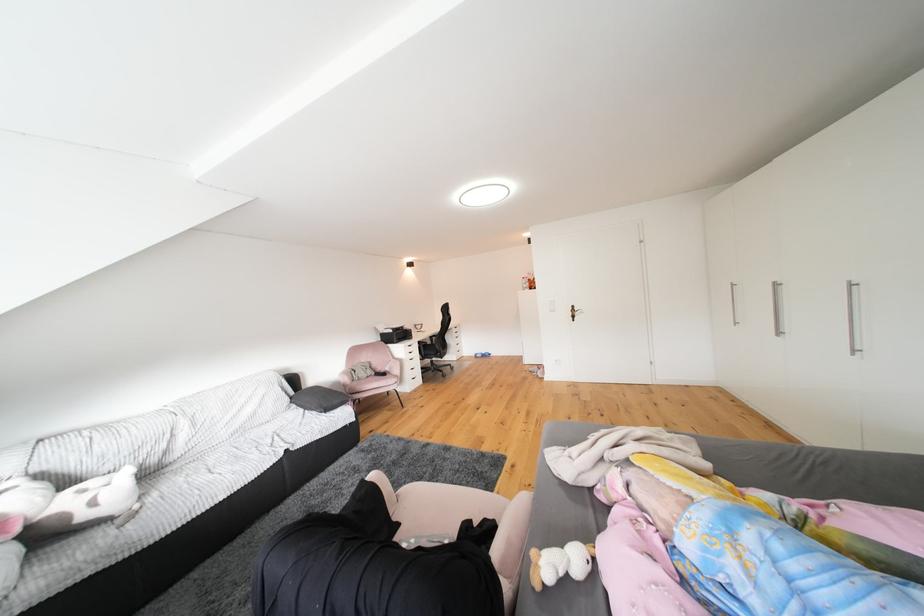
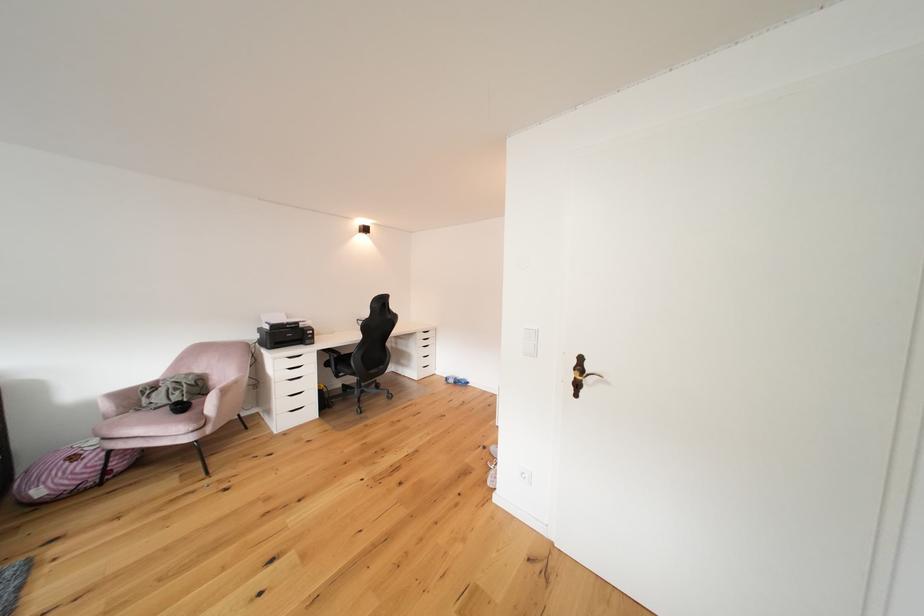
Question: I am providing you with two images of the same scene from different viewpoints. Which of the following objects are not visible in image2?

Choices:
 (A) black drawer handle
 (B) white drawer handle
 (C) black chair armrest
 (D) none of these

Answer: (D)